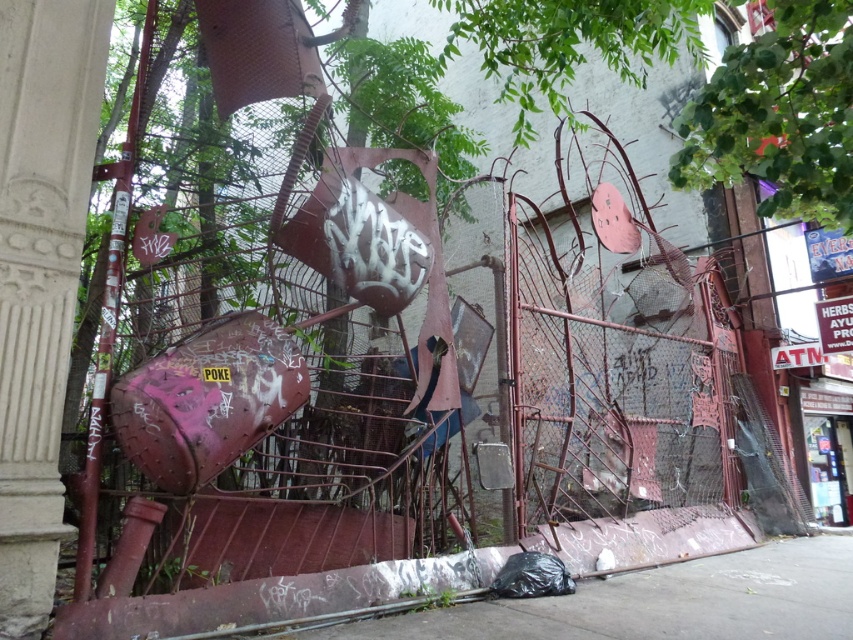
You are standing at the edge of the scene and want to walk towards the green leafy tree at upper right. Which direction should you move relative to the concrete pavement at lower center?

To reach the green leafy tree at upper right, you should move to the right of the concrete pavement at lower center since the tree is located to its right.